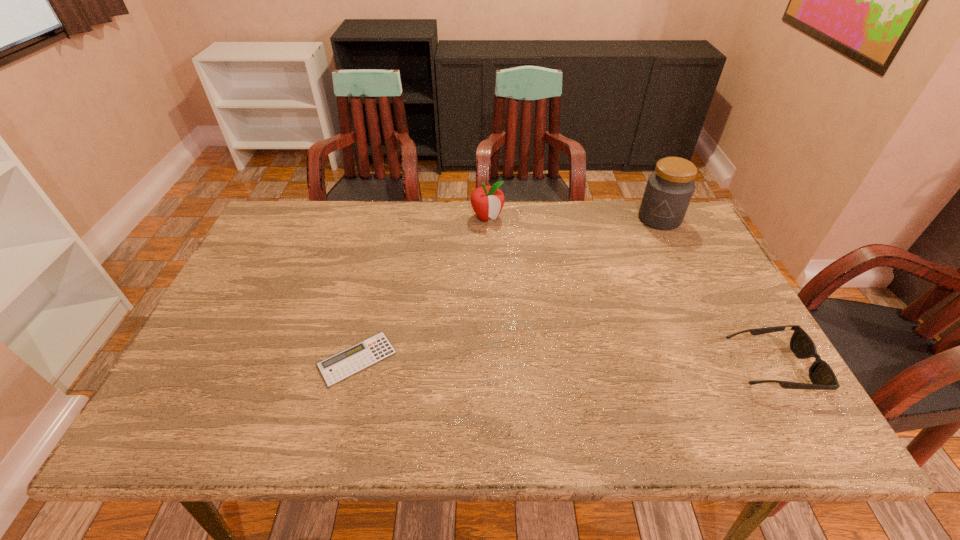
At what (x,y) coordinates should I click in order to perform the action: click on free space located on the surface of the tallest object near the warning symbol. Please return your answer as a coordinate pair (x, y). The height and width of the screenshot is (540, 960). Looking at the image, I should click on (616, 310).

This screenshot has width=960, height=540. I want to click on vacant space positioned on the surface of the tallest object near the warning symbol, so click(636, 267).

At what (x,y) coordinates should I click in order to perform the action: click on free spot located on the surface of the tallest object near the warning symbol. Please return your answer as a coordinate pair (x, y). The width and height of the screenshot is (960, 540). Looking at the image, I should click on (639, 261).

The height and width of the screenshot is (540, 960). Identify the location of apple positioned at the far edge. (487, 201).

In order to click on jar present at the far edge in this screenshot , I will do `click(669, 189)`.

Where is `calculator at the near edge`? Image resolution: width=960 pixels, height=540 pixels. calculator at the near edge is located at coordinates (368, 352).

At what (x,y) coordinates should I click in order to perform the action: click on sunglasses that is at the near edge. Please return your answer as a coordinate pair (x, y). This screenshot has width=960, height=540. Looking at the image, I should click on (821, 375).

The image size is (960, 540). I want to click on sunglasses positioned at the right edge, so click(821, 375).

I want to click on jar present at the right edge, so click(669, 189).

Locate an element on the screen. This screenshot has width=960, height=540. object positioned at the far right corner is located at coordinates (669, 189).